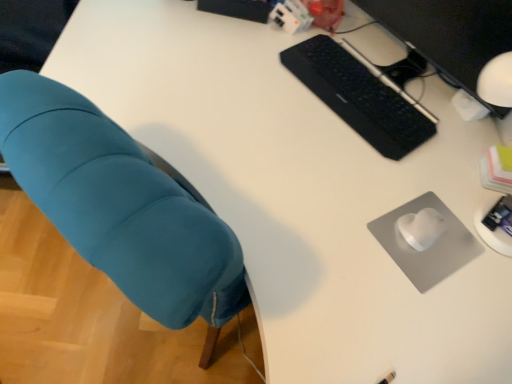
You are a GUI agent. You are given a task and a screenshot of the screen. Output one action in this format:
    pyautogui.click(x=<x>, y=<y>)
    Task: Click on the free area in between gray matte mousepad at lower right and black matte keyboard at upper right
    Image resolution: width=512 pixels, height=384 pixels.
    Given the screenshot: What is the action you would take?
    pyautogui.click(x=380, y=166)